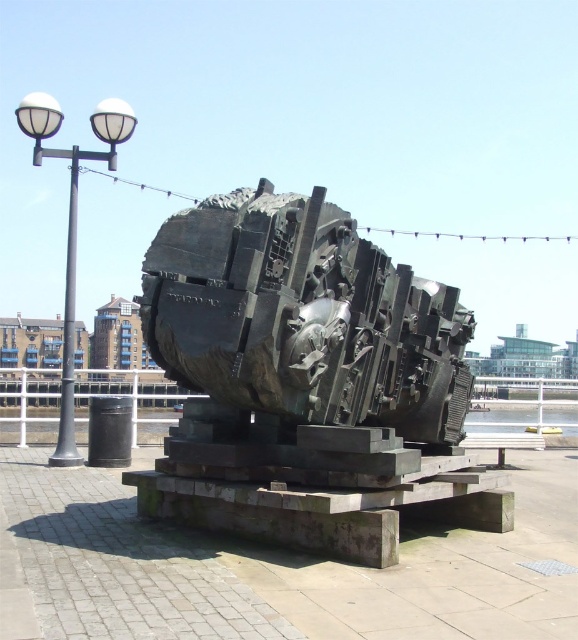
Question: Considering the relative positions of bronze sculpture at center and white metal lamp post at left in the image provided, where is bronze sculpture at center located with respect to white metal lamp post at left?

Choices:
 (A) above
 (B) below

Answer: (B)

Question: Does bronze sculpture at center have a lesser width compared to white metal lamp post at left?

Choices:
 (A) no
 (B) yes

Answer: (B)

Question: Which point is farther from the camera taking this photo?

Choices:
 (A) (35, 124)
 (B) (397, 352)

Answer: (A)

Question: Can you confirm if bronze sculpture at center is wider than white metal lamp post at left?

Choices:
 (A) yes
 (B) no

Answer: (B)

Question: Among these objects, which one is farthest from the camera?

Choices:
 (A) bronze sculpture at center
 (B) white metal lamp post at left

Answer: (B)